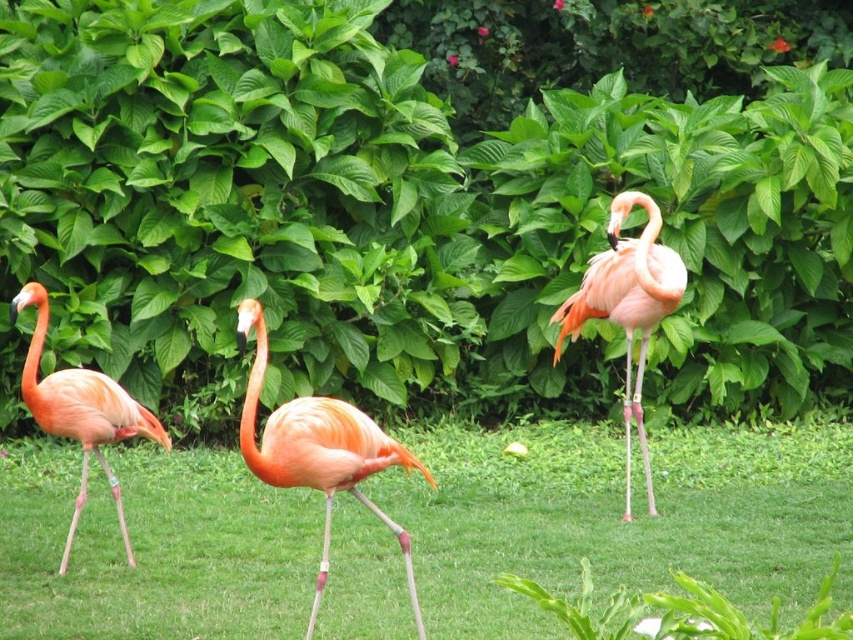
You are a photographer standing in front of the pink matte flamingo at center. You want to take a closeup photo of it without getting too close. If your camera has a zoom range of 5 meters, will you be able to capture a clear closeup?

The pink matte flamingo at center is 6.67 meters away from the viewer. Since the camera can zoom up to 5 meters, it cannot capture a clear closeup at this distance. You need to move closer or use a camera with a longer zoom range.

You are a photographer trying to capture a clear shot of the matte orange flamingo at center. The green grass at center is blocking part of your view. Can you determine if you can see the entire flamingo without the grass obscuring it?

The green grass at center is shorter than the matte orange flamingo at center, so yes, you can see the entire flamingo without the grass obscuring it.